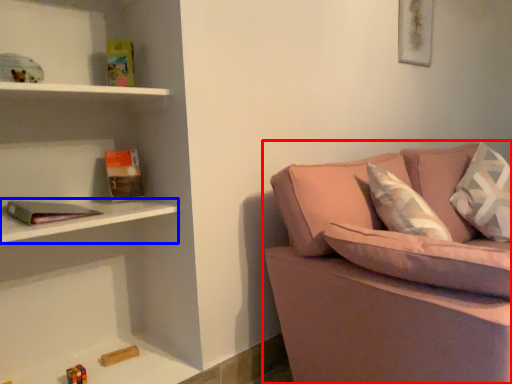
Question: Which of the following is the farthest to the observer, studio couch (highlighted by a red box) or cabinet (highlighted by a blue box)?

Choices:
 (A) studio couch
 (B) cabinet

Answer: (B)